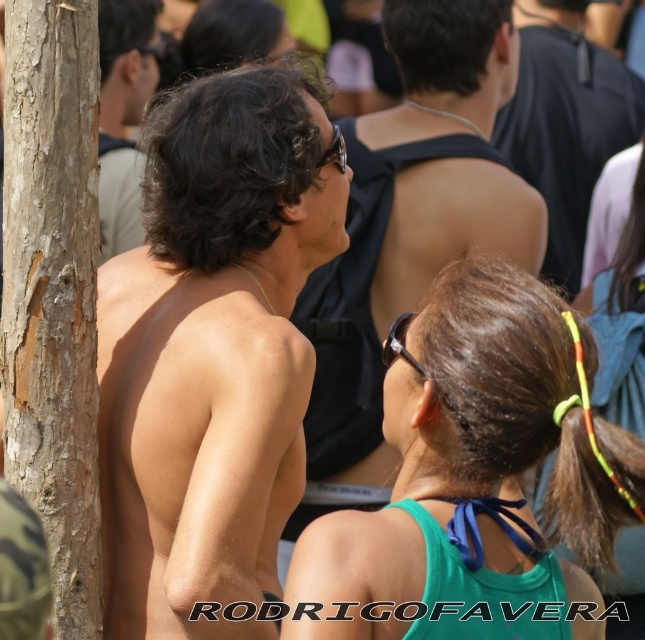
You are a photographer trying to capture the scene. Since you want to highlight the contrast between the natural texture of the tree and the modern clothing, which object should you focus on to ensure the texture of the brown rough bark at left is visible without overwhelming the black matte tank top at upper center?

The brown rough bark at left occupies less space than the black matte tank top at upper center, so focusing on the brown rough bark at left would allow its texture to stand out without overpowering the larger black matte tank top at upper center.

You are a photographer trying to capture a closeup shot of the matte skin at left and the dark brown hair at upper center. Based on their sizes, which one would require you to zoom in more to fill the frame?

The matte skin at left is larger in size than the dark brown hair at upper center, so you would need to zoom in more on the dark brown hair at upper center to fill the frame since it is smaller.

You are standing in the scene and want to move from point (154, 12) to point (408, 230). Which direction should you move to get closer to the viewer?

To move from point (154, 12) to point (408, 230) and get closer to the viewer, you should move towards point (408, 230) since it is closer to the viewer than point (154, 12).